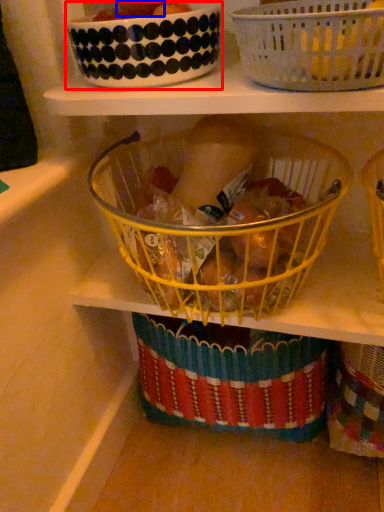
Question: Which object appears closest to the camera in this image, glass bowl (highlighted by a red box) or fruit (highlighted by a blue box)?

Choices:
 (A) glass bowl
 (B) fruit

Answer: (A)